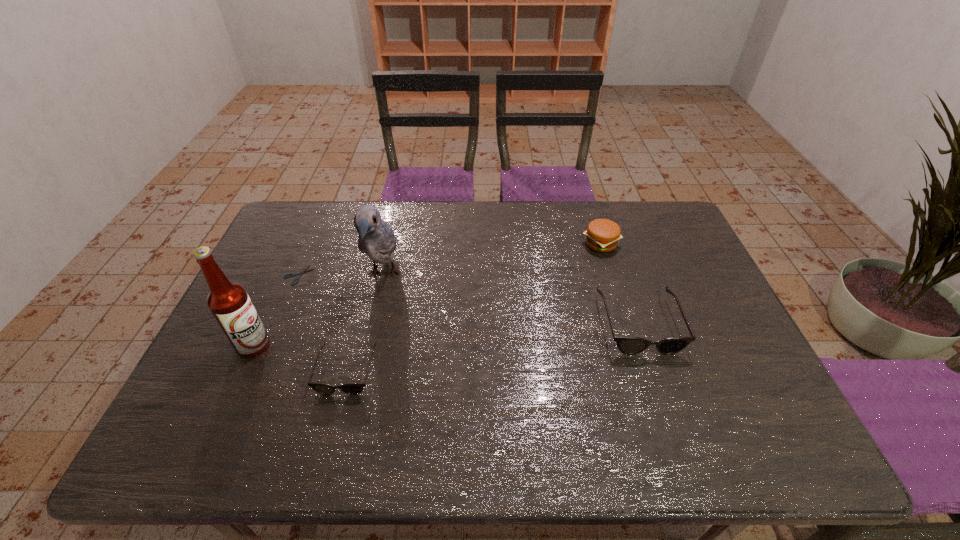
If equal spacing is desired by inserting an extra sunglasses among them, please point out a free spot for this new sunglasses. Please provide its 2D coordinates. Your answer should be formatted as a tuple, i.e. [(x, y)], where the tuple contains the x and y coordinates of a point satisfying the conditions above.

[(499, 346)]